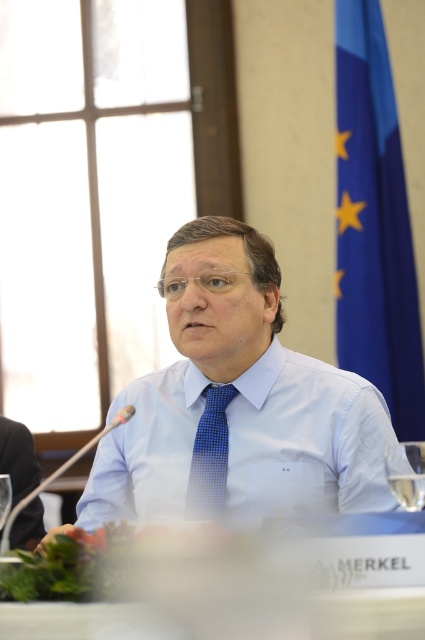
Question: Estimate the real-world distances between objects in this image. Which object is farther from the blue fabric flag at right?

Choices:
 (A) blue dotted tie at center
 (B) light blue shirt at center

Answer: (A)

Question: Estimate the real-world distances between objects in this image. Which object is farther from the light blue shirt at center?

Choices:
 (A) blue dotted tie at center
 (B) blue fabric flag at right

Answer: (B)

Question: Can you confirm if light blue shirt at center is positioned below blue dotted tie at center?

Choices:
 (A) no
 (B) yes

Answer: (A)

Question: Which point is farther to the camera?

Choices:
 (A) blue fabric flag at right
 (B) light blue shirt at center
 (C) blue dotted tie at center

Answer: (A)

Question: Does blue fabric flag at right have a greater width compared to blue dotted tie at center?

Choices:
 (A) no
 (B) yes

Answer: (B)

Question: Where is blue fabric flag at right located in relation to blue dotted tie at center in the image?

Choices:
 (A) right
 (B) left

Answer: (A)